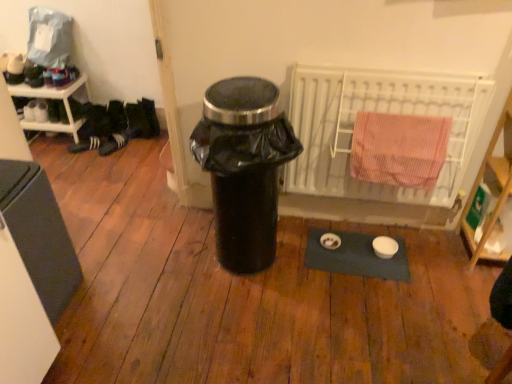
Where is `empty space that is to the right of white textured shoe at left, which appears as the 2th shoe when viewed from the left`? empty space that is to the right of white textured shoe at left, which appears as the 2th shoe when viewed from the left is located at coordinates (129, 141).